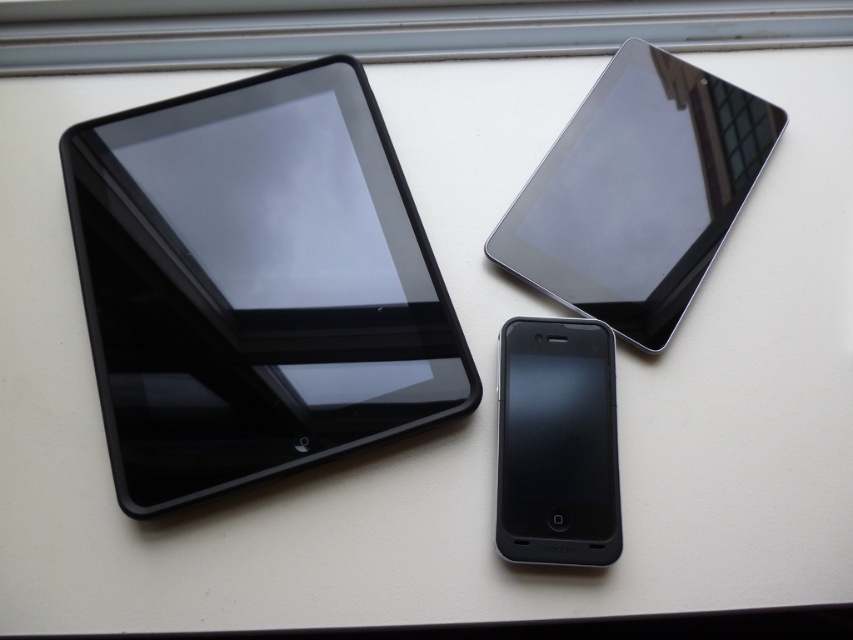
Question: Is glossy black tablet at upper right to the left of matte black tablet at center from the viewer's perspective?

Choices:
 (A) yes
 (B) no

Answer: (B)

Question: Estimate the real-world distances between objects in this image. Which object is farther from the matte black tablet at center?

Choices:
 (A) glossy black tablet at upper right
 (B) black glossy tablet at left

Answer: (B)

Question: Based on their relative distances, which object is nearer to the glossy black tablet at upper right?

Choices:
 (A) black glossy tablet at left
 (B) matte black tablet at center

Answer: (B)

Question: Where is black glossy tablet at left located in relation to matte black tablet at center in the image?

Choices:
 (A) left
 (B) right

Answer: (A)

Question: Which object is positioned closest to the glossy black tablet at upper right?

Choices:
 (A) matte black tablet at center
 (B) black glossy tablet at left

Answer: (A)

Question: Is black glossy tablet at left below glossy black tablet at upper right?

Choices:
 (A) no
 (B) yes

Answer: (B)